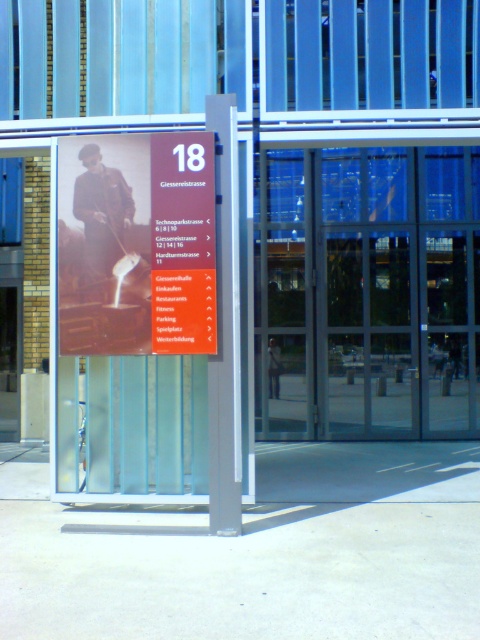
Who is shorter, transparent glass door at center or matte brown poster at center?

With less height is matte brown poster at center.

Can you confirm if transparent glass door at center is bigger than matte brown poster at center?

Correct, transparent glass door at center is larger in size than matte brown poster at center.

Where is `transparent glass door at center`? The height and width of the screenshot is (640, 480). transparent glass door at center is located at coordinates (367, 292).

Who is shorter, matte brown poster at center or orange glossy sign at center?

Standing shorter between the two is orange glossy sign at center.

Is point (108, 349) less distant than point (196, 173)?

That is False.

This screenshot has height=640, width=480. Find the location of `matte brown poster at center`. matte brown poster at center is located at coordinates (137, 246).

Between transparent glass door at center and orange glossy sign at center, which one is positioned higher?

Positioned higher is orange glossy sign at center.

Between transparent glass door at center and orange glossy sign at center, which one has more height?

transparent glass door at center

Measure the distance between transparent glass door at center and camera.

transparent glass door at center is 12.42 meters from camera.

The width and height of the screenshot is (480, 640). Identify the location of transparent glass door at center. (367, 292).